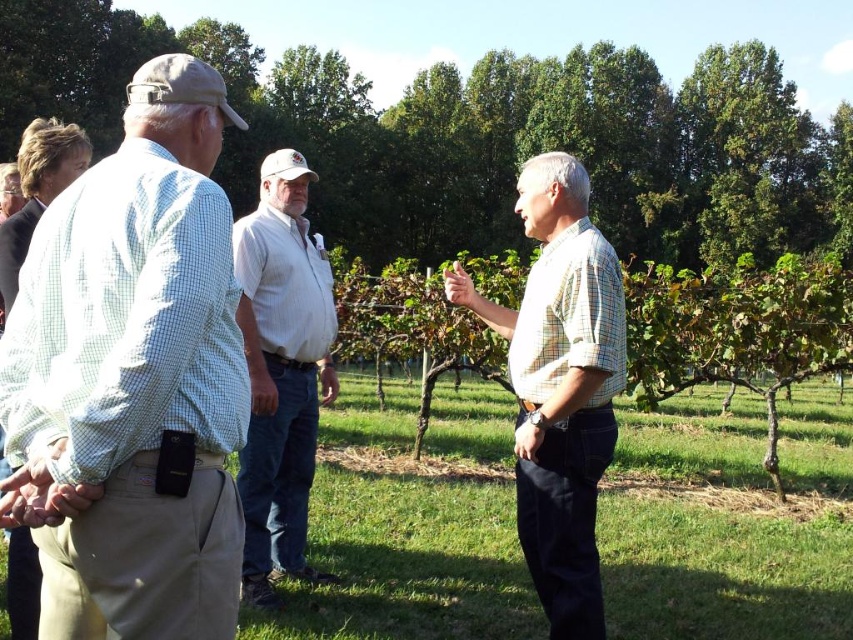
Between yellow-green checkered shirt at center and green checkered shirt at left, which one has more height?

Standing taller between the two is green checkered shirt at left.

Who is more distant from viewer, (524, 445) or (22, 225)?

The point (22, 225) is behind.

Image resolution: width=853 pixels, height=640 pixels. I want to click on yellow-green checkered shirt at center, so click(x=560, y=387).

Who is lower down, light green checkered shirt at left or yellow-green checkered shirt at center?

yellow-green checkered shirt at center is lower down.

The height and width of the screenshot is (640, 853). What do you see at coordinates (132, 378) in the screenshot?
I see `light green checkered shirt at left` at bounding box center [132, 378].

The image size is (853, 640). I want to click on light green checkered shirt at left, so pos(132,378).

Does point (280, 557) come behind point (15, 536)?

Yes.

Does white striped shirt at center have a greater height compared to green checkered shirt at left?

No, white striped shirt at center is not taller than green checkered shirt at left.

Which is behind, point (297, 522) or point (15, 218)?

Positioned behind is point (297, 522).

The width and height of the screenshot is (853, 640). Find the location of `white striped shirt at center`. white striped shirt at center is located at coordinates (281, 371).